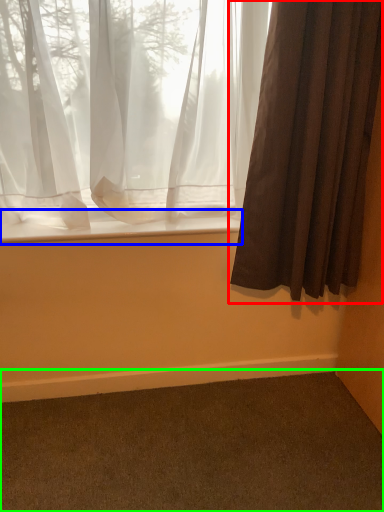
Question: Considering the real-world distances, which object is farthest from curtain (highlighted by a red box)? window sill (highlighted by a blue box) or plain (highlighted by a green box)?

Choices:
 (A) window sill
 (B) plain

Answer: (B)